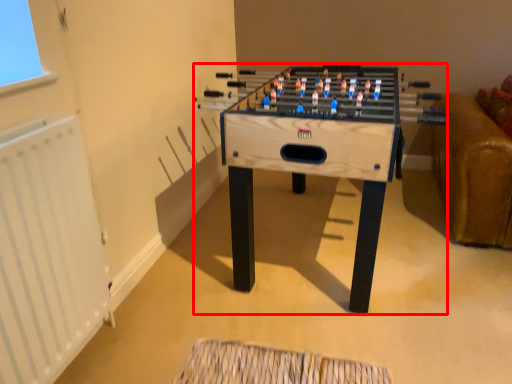
Question: Considering the relative positions of table (annotated by the red box) and radiator in the image provided, where is table (annotated by the red box) located with respect to the staircase?

Choices:
 (A) left
 (B) right

Answer: (B)